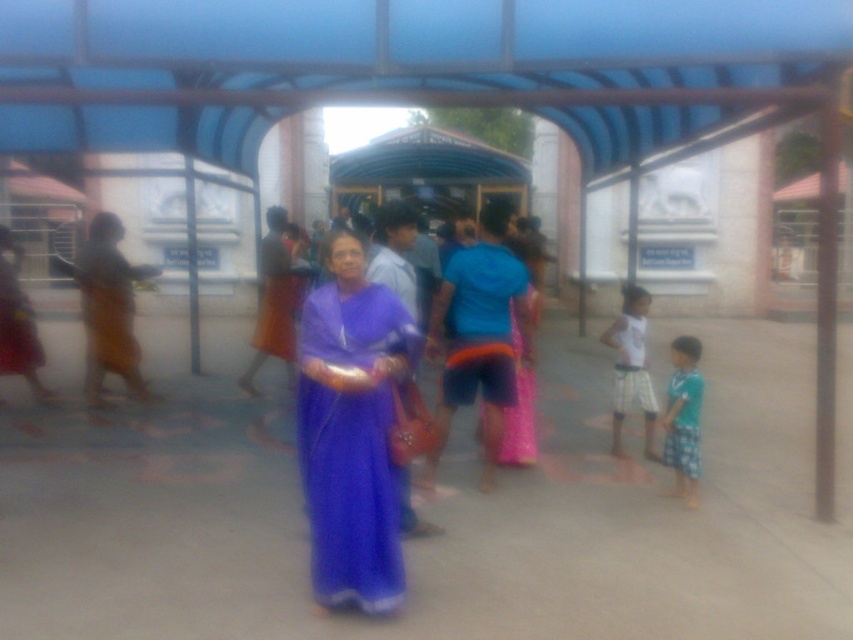
Question: Is matte purple sari at center bigger than matte purple dress at center?

Choices:
 (A) yes
 (B) no

Answer: (A)

Question: From the image, what is the correct spatial relationship of matte purple sari at center in relation to white cotton shirt at center?

Choices:
 (A) left
 (B) right

Answer: (A)

Question: Which of the following is the farthest from the observer?

Choices:
 (A) matte purple sari at center
 (B) white cotton shirt at center

Answer: (B)

Question: Which is farther from the white cotton shirt at center?

Choices:
 (A) matte purple dress at center
 (B) matte purple sari at center
 (C) green plaid shorts at lower right

Answer: (A)

Question: Is matte purple sari at center closer to camera compared to green plaid shorts at lower right?

Choices:
 (A) yes
 (B) no

Answer: (A)

Question: Which point is farther to the camera?

Choices:
 (A) (277, 316)
 (B) (604, 336)
 (C) (672, 433)
 (D) (302, 323)

Answer: (A)